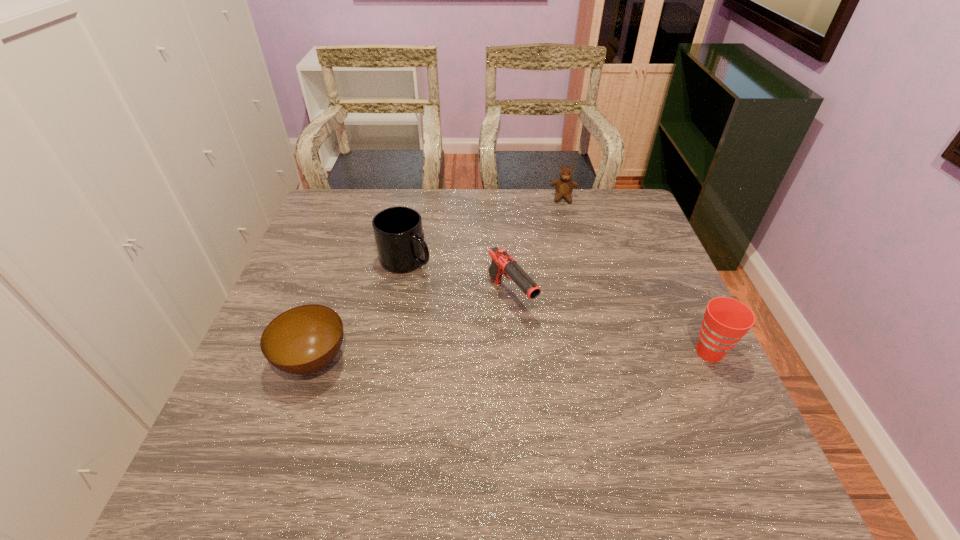
Identify the location of object that is at the right edge. (726, 320).

Find the location of a particular element. The width and height of the screenshot is (960, 540). free space at the far edge of the desktop is located at coordinates (408, 194).

Where is `vacant space at the left edge of the desktop`? Image resolution: width=960 pixels, height=540 pixels. vacant space at the left edge of the desktop is located at coordinates (347, 247).

In the image, there is a desktop. Identify the location of vacant region at the right edge. The width and height of the screenshot is (960, 540). click(623, 235).

Image resolution: width=960 pixels, height=540 pixels. I want to click on vacant region at the far left corner of the desktop, so click(347, 214).

Where is `free space at the far right corner`? free space at the far right corner is located at coordinates (642, 224).

Identify the location of free area in between the bowl and the rightmost object. This screenshot has width=960, height=540. (511, 356).

Locate an element on the screen. This screenshot has width=960, height=540. free space that is in between the rightmost object and the mug is located at coordinates (558, 306).

Where is `vacant space that is in between the leftmost object and the rightmost object`? vacant space that is in between the leftmost object and the rightmost object is located at coordinates (511, 356).

Where is `free point between the cup and the mug`? This screenshot has height=540, width=960. free point between the cup and the mug is located at coordinates (558, 306).